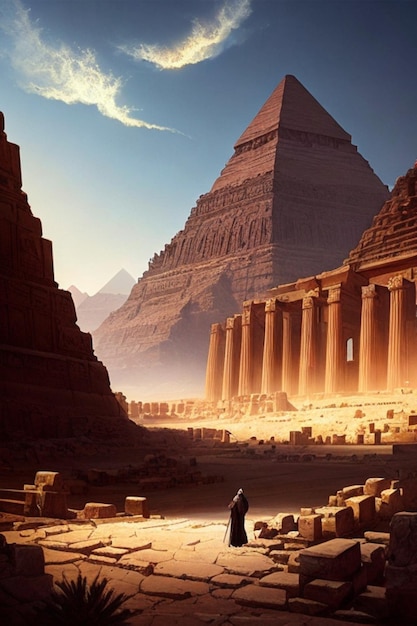
I want to click on robe, so click(x=229, y=520).